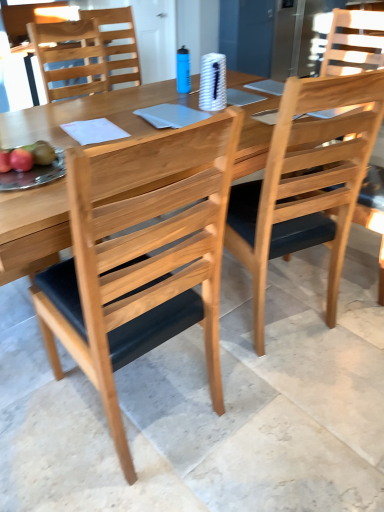
Locate an element on the screen. The height and width of the screenshot is (512, 384). vacant space in light brown wood chair at center, marked as the second chair in a back-to-front arrangement (from a real-world perspective) is located at coordinates (276, 315).